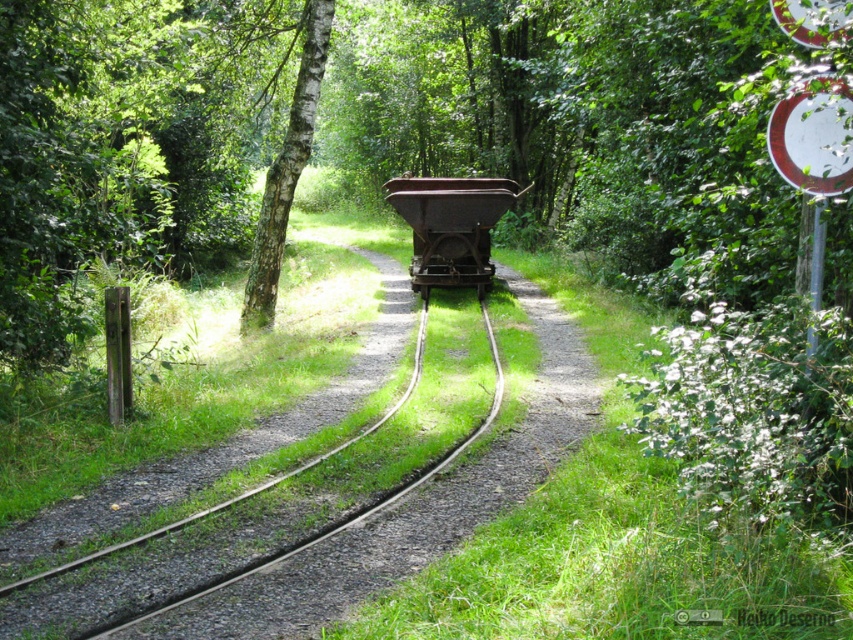
Question: Which object appears closest to the camera in this image?

Choices:
 (A) rusty metal train cart at center
 (B) white smooth tree at center

Answer: (A)

Question: Which of the following is the farthest from the observer?

Choices:
 (A) rusty metal cart at center
 (B) rusty metal train cart at center
 (C) white smooth tree at center

Answer: (A)

Question: Is rusty metal train cart at center above rusty metal cart at center?

Choices:
 (A) no
 (B) yes

Answer: (A)

Question: Does rusty metal train cart at center have a larger size compared to white smooth tree at center?

Choices:
 (A) no
 (B) yes

Answer: (B)

Question: Which point appears closest to the camera in this image?

Choices:
 (A) (306, 154)
 (B) (438, 232)

Answer: (A)

Question: Can you confirm if rusty metal train cart at center is thinner than rusty metal cart at center?

Choices:
 (A) yes
 (B) no

Answer: (B)